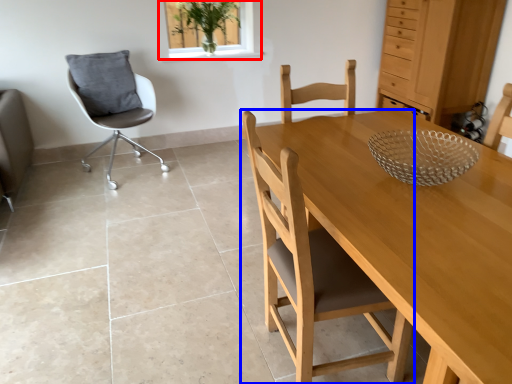
Question: Which object is closer to the camera taking this photo, window (highlighted by a red box) or chair (highlighted by a blue box)?

Choices:
 (A) window
 (B) chair

Answer: (B)